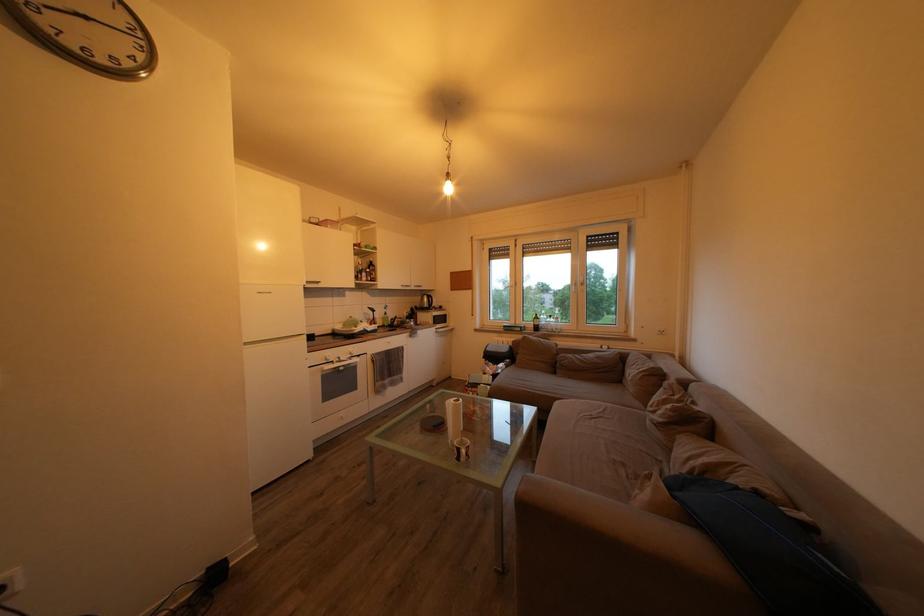
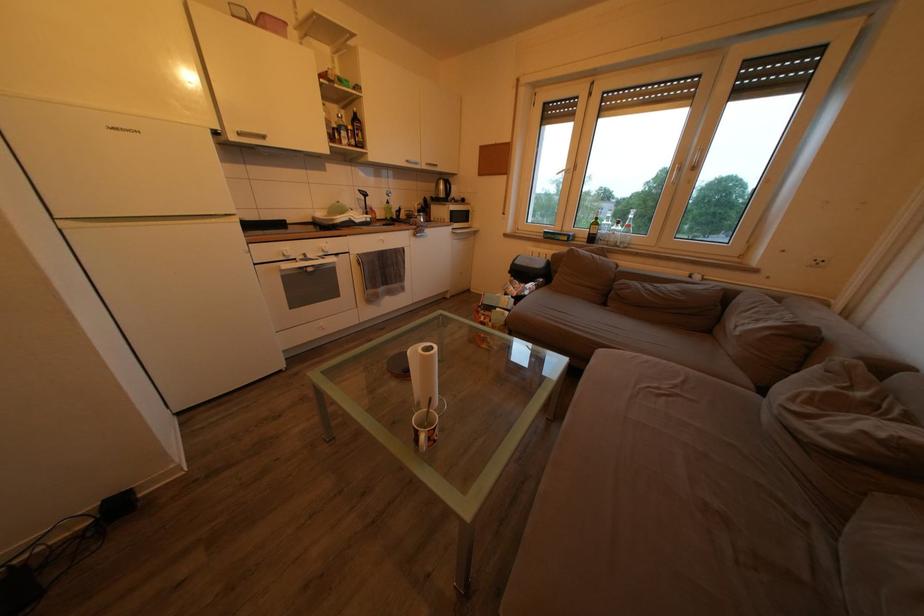
Question: In a continuous first-person perspective shot, in which direction is the camera moving?

Choices:
 (A) Left
 (B) Right
 (C) Forward
 (D) Backward

Answer: (C)